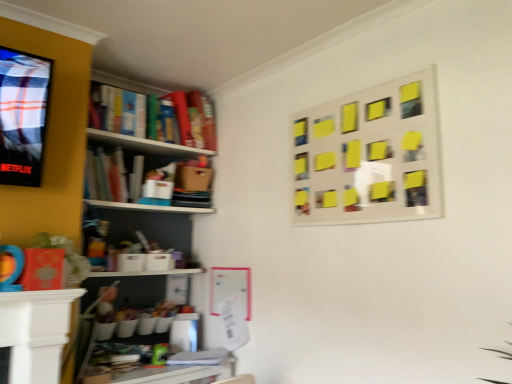
Describe the element at coordinates (36, 332) in the screenshot. I see `white glossy table at lower left, acting as the 1th table starting from the front` at that location.

The height and width of the screenshot is (384, 512). Describe the element at coordinates (172, 372) in the screenshot. I see `wooden desk at lower center, which is the 1th table in bottom-to-top order` at that location.

At what (x,y) coordinates should I click in order to perform the action: click on wooden desk at lower center, which is the 1th table in bottom-to-top order. Please return your answer as a coordinate pair (x, y). The width and height of the screenshot is (512, 384). Looking at the image, I should click on (172, 372).

You are a GUI agent. You are given a task and a screenshot of the screen. Output one action in this format:
    pyautogui.click(x=<x>, y=<y>)
    Task: Click on the yellow sticky notes at upper right
    
    Given the screenshot: What is the action you would take?
    pyautogui.click(x=370, y=156)

At what (x,y) coordinates should I click in order to perform the action: click on white glossy table at lower left, acting as the 2th table starting from the bottom. Please return your answer as a coordinate pair (x, y). Looking at the image, I should click on (36, 332).

Which is in front, point (356, 222) or point (30, 313)?

The point (30, 313) is in front.

Is yellow sticky notes at upper right in front of or behind white glossy table at lower left, which ranks as the second table in back-to-front order, in the image?

yellow sticky notes at upper right is in front of white glossy table at lower left, which ranks as the second table in back-to-front order.

Does yellow sticky notes at upper right turn towards white glossy table at lower left, acting as the 1th table starting from the front?

No, yellow sticky notes at upper right is not turned towards white glossy table at lower left, acting as the 1th table starting from the front.

From a real-world perspective, which is physically above, yellow sticky notes at upper right or white glossy table at lower left, which ranks as the first table in top-to-bottom order?

In real-world perspective, yellow sticky notes at upper right is above.

Where is `bulletin board in front of the wooden desk at lower center, positioned as the 2th table in front-to-back order`? bulletin board in front of the wooden desk at lower center, positioned as the 2th table in front-to-back order is located at coordinates (370, 156).

From a real-world perspective, is yellow sticky notes at upper right located higher than wooden desk at lower center, placed as the 2th table when sorted from top to bottom?

Yes, from a real-world perspective, yellow sticky notes at upper right is over wooden desk at lower center, placed as the 2th table when sorted from top to bottom

Consider the image. From the image's perspective, is yellow sticky notes at upper right below wooden desk at lower center, which is the 1th table in bottom-to-top order?

Incorrect, from the image's perspective, yellow sticky notes at upper right is higher than wooden desk at lower center, which is the 1th table in bottom-to-top order.

Does yellow sticky notes at upper right appear on the left side of wooden desk at lower center, the 1th table viewed from the back?

Incorrect, yellow sticky notes at upper right is not on the left side of wooden desk at lower center, the 1th table viewed from the back.

Is point (48, 308) positioned before point (391, 206)?

Yes, point (48, 308) is in front of point (391, 206).

From the image's perspective, is white glossy table at lower left, which ranks as the first table in top-to-bottom order, below yellow sticky notes at upper right?

Yes.

How many degrees apart are the facing directions of white glossy table at lower left, acting as the 1th table starting from the front, and yellow sticky notes at upper right?

There is a 90-degree angle between the facing directions of white glossy table at lower left, acting as the 1th table starting from the front, and yellow sticky notes at upper right.

Is white glossy table at lower left, which ranks as the second table in back-to-front order, facing towards yellow sticky notes at upper right?

No, white glossy table at lower left, which ranks as the second table in back-to-front order, is not aimed at yellow sticky notes at upper right.

In the scene shown: Can you confirm if white glossy table at lower left, acting as the 2th table starting from the bottom, is taller than wooden desk at lower center, which is the 1th table in bottom-to-top order?

Yes.

Is wooden desk at lower center, positioned as the 2th table in front-to-back order, inside white glossy table at lower left, which ranks as the second table in back-to-front order?

Definitely not — wooden desk at lower center, positioned as the 2th table in front-to-back order, is not inside white glossy table at lower left, which ranks as the second table in back-to-front order.

From a real-world perspective, which is physically above, white glossy table at lower left, acting as the 1th table starting from the front, or wooden desk at lower center, positioned as the 2th table in front-to-back order?

white glossy table at lower left, acting as the 1th table starting from the front, from a real-world perspective.

Is the surface of white glossy table at lower left, which ranks as the first table in top-to-bottom order, in direct contact with wooden desk at lower center, placed as the 2th table when sorted from top to bottom?

They are not placed beside each other.

From a real-world perspective, is wooden desk at lower center, placed as the 2th table when sorted from top to bottom, positioned over white glossy table at lower left, which ranks as the second table in back-to-front order, based on gravity?

No.

Could you tell me if wooden desk at lower center, positioned as the 2th table in front-to-back order, is facing white glossy table at lower left, acting as the 2th table starting from the bottom?

No, wooden desk at lower center, positioned as the 2th table in front-to-back order, does not turn towards white glossy table at lower left, acting as the 2th table starting from the bottom.

Is wooden desk at lower center, which is the 1th table in bottom-to-top order, further to the viewer compared to white glossy table at lower left, which ranks as the first table in top-to-bottom order?

Yes, the depth of wooden desk at lower center, which is the 1th table in bottom-to-top order, is greater than that of white glossy table at lower left, which ranks as the first table in top-to-bottom order.

How many degrees apart are the facing directions of wooden desk at lower center, which is the 1th table in bottom-to-top order, and yellow sticky notes at upper right?

The angle between the facing direction of wooden desk at lower center, which is the 1th table in bottom-to-top order, and the facing direction of yellow sticky notes at upper right is 90 degrees.

Is wooden desk at lower center, which is the 1th table in bottom-to-top order, not close to yellow sticky notes at upper right?

Yes, wooden desk at lower center, which is the 1th table in bottom-to-top order, and yellow sticky notes at upper right are quite far apart.

Is wooden desk at lower center, placed as the 2th table when sorted from top to bottom, facing towards yellow sticky notes at upper right?

No, wooden desk at lower center, placed as the 2th table when sorted from top to bottom, does not turn towards yellow sticky notes at upper right.

Which object is closer to the camera taking this photo, wooden desk at lower center, the 1th table viewed from the back, or yellow sticky notes at upper right?

Positioned in front is yellow sticky notes at upper right.

At what (x,y) coordinates should I click in order to perform the action: click on bulletin board above the white glossy table at lower left, which ranks as the first table in top-to-bottom order (from a real-world perspective). Please return your answer as a coordinate pair (x, y). The height and width of the screenshot is (384, 512). Looking at the image, I should click on (370, 156).

Find the location of a particular element. the 1st table counting from the left side of the yellow sticky notes at upper right is located at coordinates (172, 372).

From the image, which object appears to be nearer to wooden desk at lower center, which is the 1th table in bottom-to-top order, white glossy table at lower left, acting as the 1th table starting from the front, or yellow sticky notes at upper right?

white glossy table at lower left, acting as the 1th table starting from the front, is positioned closer to the anchor wooden desk at lower center, which is the 1th table in bottom-to-top order.

Considering their positions, is white glossy table at lower left, acting as the 1th table starting from the front, positioned further to yellow sticky notes at upper right than wooden desk at lower center, which is the 1th table in bottom-to-top order?

white glossy table at lower left, acting as the 1th table starting from the front, is further to yellow sticky notes at upper right.

Which object lies nearer to the anchor point yellow sticky notes at upper right, wooden desk at lower center, placed as the 2th table when sorted from top to bottom, or white glossy table at lower left, acting as the 1th table starting from the front?

Based on the image, wooden desk at lower center, placed as the 2th table when sorted from top to bottom, appears to be nearer to yellow sticky notes at upper right.

Considering their positions, is yellow sticky notes at upper right positioned further to white glossy table at lower left, which ranks as the second table in back-to-front order, than wooden desk at lower center, placed as the 2th table when sorted from top to bottom?

yellow sticky notes at upper right lies further to white glossy table at lower left, which ranks as the second table in back-to-front order, than the other object.

Based on their spatial positions, is wooden desk at lower center, placed as the 2th table when sorted from top to bottom, or yellow sticky notes at upper right further from white glossy table at lower left, which ranks as the first table in top-to-bottom order?

Among the two, yellow sticky notes at upper right is located further to white glossy table at lower left, which ranks as the first table in top-to-bottom order.

From the image, which object appears to be nearer to wooden desk at lower center, which is the 1th table in bottom-to-top order, yellow sticky notes at upper right or white glossy table at lower left, acting as the 1th table starting from the front?

white glossy table at lower left, acting as the 1th table starting from the front, is closer to wooden desk at lower center, which is the 1th table in bottom-to-top order.

This screenshot has height=384, width=512. I want to click on table located between white glossy table at lower left, which ranks as the second table in back-to-front order, and yellow sticky notes at upper right in the left-right direction, so click(172, 372).